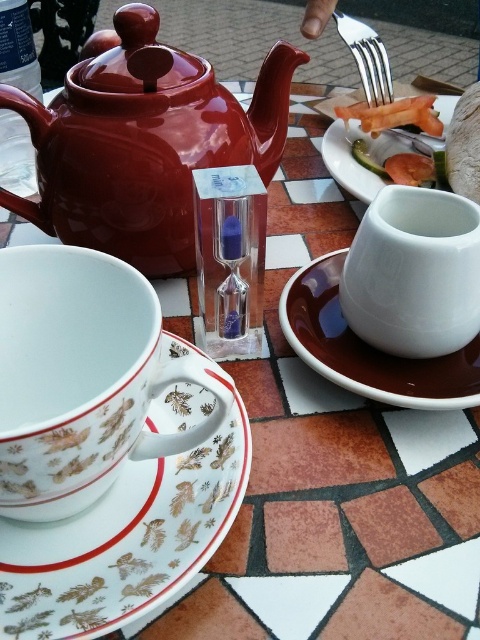
You are setting up a tea service and need to place the glossy ceramic teapot at upper left and the shiny plastic fork at upper right on a shelf. The shelf has a height limit of 15 cm. Can both items fit vertically without exceeding the shelf height?

The glossy ceramic teapot at upper left has a greater height compared to the shiny plastic fork at upper right. Since the teapot is taller, if its height exceeds 15 cm, the fork might still fit, but the teapot may not. However, without specific measurements, we can only confirm that the teapot is taller than the fork. If the teapot is under 15 cm, both can fit. If not, only the fork would fit.

You are a guest at a tea ceremony and need to place a small teabag on the table. The host mentioned that the white porcelain plate at lower left is closer to you than the white glossy teacup at center. Where should you place the teabag to ensure it is closest to you?

You should place the teabag on the white porcelain plate at lower left because it is in front of the white glossy teacup at center, making it closer to you.

You are a tea lover who wants to place a sugar cube into the white porcelain teacup at center. The sugar cube is currently on the brown saucer to the right of the teacup. Can you determine the direction you need to move the sugar cube to reach the teacup?

The sugar cube needs to be moved to the left to reach the white porcelain teacup at center since the sugar cube is currently on the brown saucer to the right of the teacup.